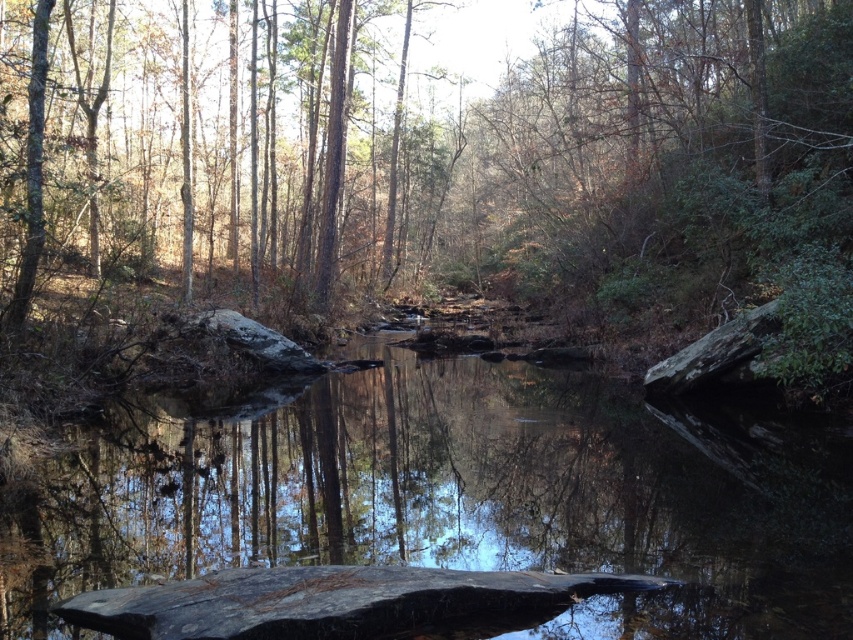
Can you confirm if smooth rock at center is taller than smooth dark wood at center?

Yes, smooth rock at center is taller than smooth dark wood at center.

Is smooth rock at center below smooth dark wood at center?

No.

Who is more distant from viewer, (338, 413) or (506, 614)?

Point (338, 413)

Find the location of a particular element. smooth rock at center is located at coordinates (457, 499).

Measure the distance between green leafy tree at center and camera.

green leafy tree at center and camera are 44.14 feet apart.

Which is in front, point (24, 13) or point (341, 465)?

Positioned in front is point (341, 465).

Find the location of `green leafy tree at center`. green leafy tree at center is located at coordinates (442, 168).

Can you confirm if green leafy tree at center is shorter than smooth dark wood at center?

In fact, green leafy tree at center may be taller than smooth dark wood at center.

Who is higher up, green leafy tree at center or smooth dark wood at center?

green leafy tree at center is above.

Does point (492, 147) come behind point (273, 609)?

Yes, it is behind point (273, 609).

At what (x,y) coordinates should I click in order to perform the action: click on green leafy tree at center. Please return your answer as a coordinate pair (x, y). Image resolution: width=853 pixels, height=640 pixels. Looking at the image, I should click on (442, 168).